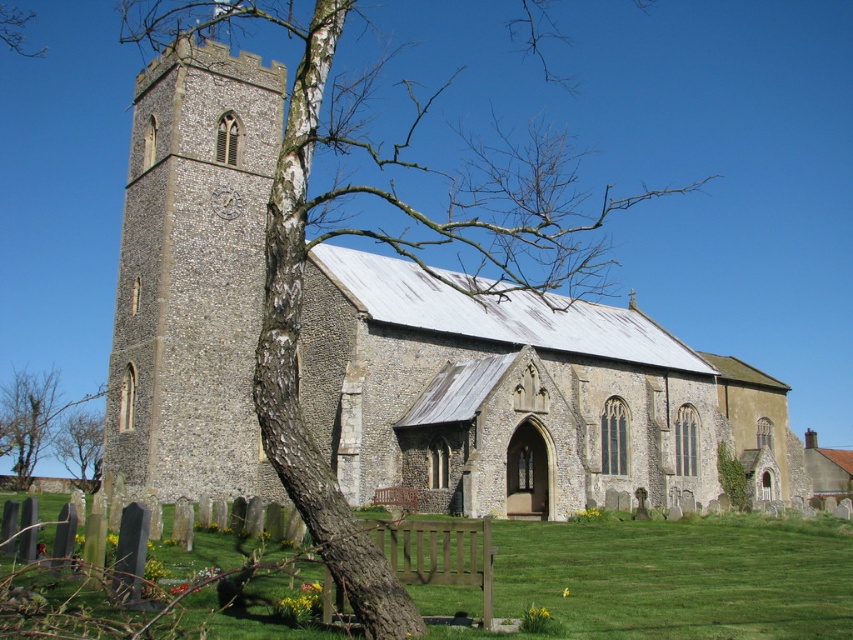
Based on the photo, you are standing in the graveyard looking towards the church. You need to place a new rectangular flower bed between the stone tower at left and the green leafy bush at lower right. Based on their widths, which object should you position closer to the flower bed to ensure it fits properly?

The stone tower at left might be wider than the green leafy bush at lower right, so positioning the flower bed closer to the narrower green leafy bush at lower right would ensure better fit.

You are standing at the center of the grassy area in front of the historic stone church. You need to locate the stone tower at left. In which direction should you look to see it?

The stone tower at left is located at point coordinates (193,275), so you should look to your left side to see it.